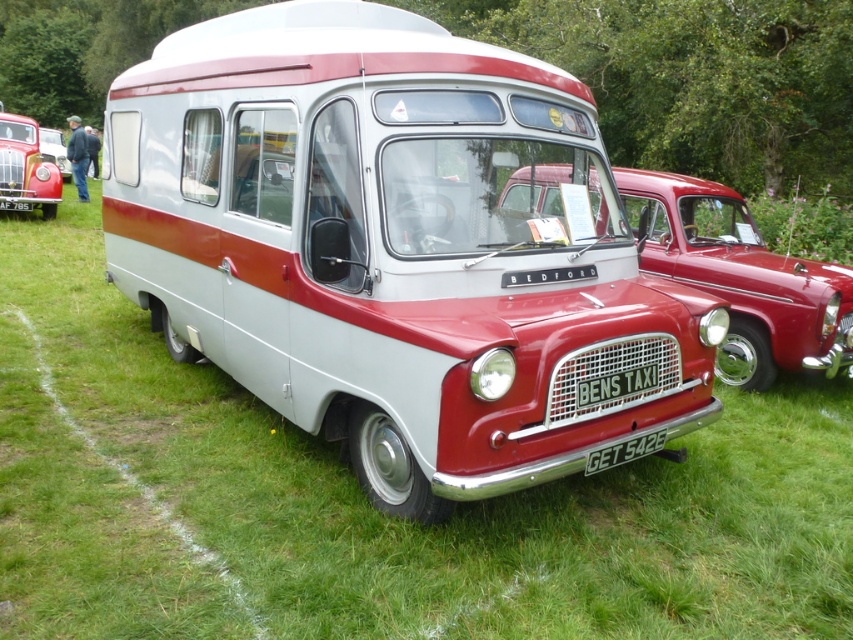
You are a photographer standing at the edge of a car show event. You want to take a photo of both the matte red taxi at center and the matte red van at center in the same frame. Considering your camera has a maximum focus range of 45 feet, will both vehicles be in focus?

The matte red taxi at center is 46.31 feet away from the matte red van at center. Since the distance between them exceeds the camera maximum focus range of 45 feet, both vehicles cannot be in focus at the same time.

You are a photographer planning to take a photo of the matte red taxi at center and the matte red van at center. Since both are red, you want to ensure they are clearly distinguishable in the final image. Based on their positions, which one is located lower in the image?

The matte red taxi at center is positioned under the matte red van at center, so the taxi is lower in the image.